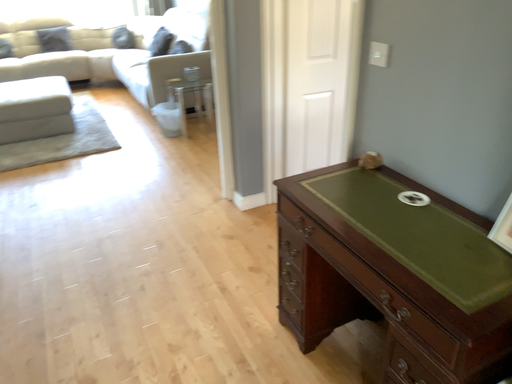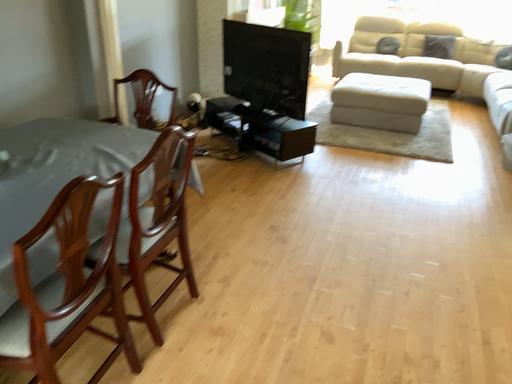
Question: Which way did the camera rotate in the video?

Choices:
 (A) rotated left
 (B) rotated right

Answer: (A)